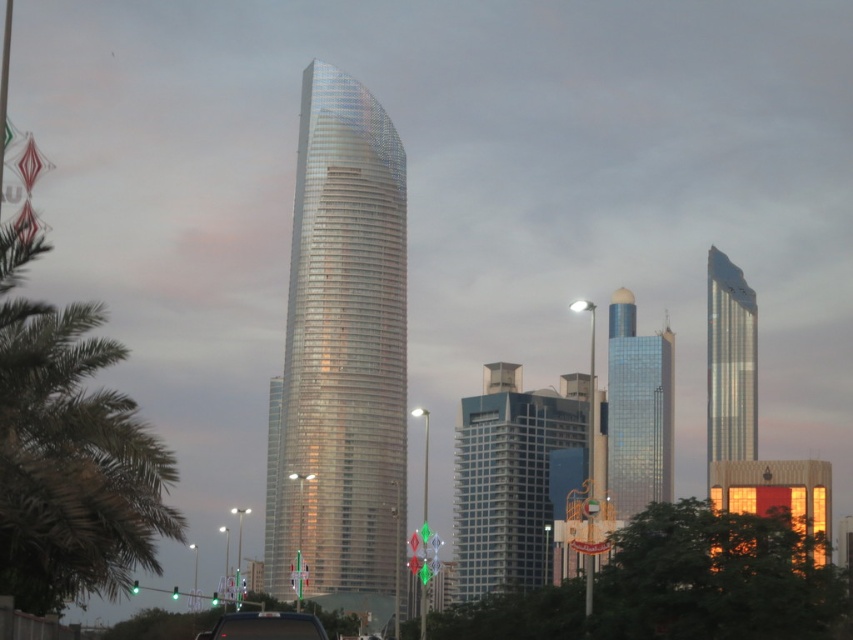
You are standing in the city at dusk and see the glossy glass skyscraper at center and the black glossy car at center. Which object is closer to you?

The glossy glass skyscraper at center is closer to you than the black glossy car at center because it is further to the viewer.

You are standing in the city at dusk and see two points in the skyline image. The first point is at coordinates point (325, 534) and the second is at point (717, 326). Which point is closer to you?

Point (325, 534) is closer to the camera than point (717, 326).